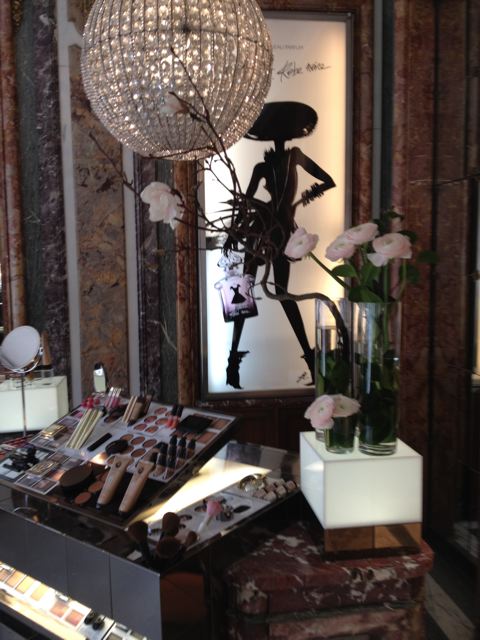
Where is `crystal fixture`? This screenshot has height=640, width=480. crystal fixture is located at coordinates (228, 22).